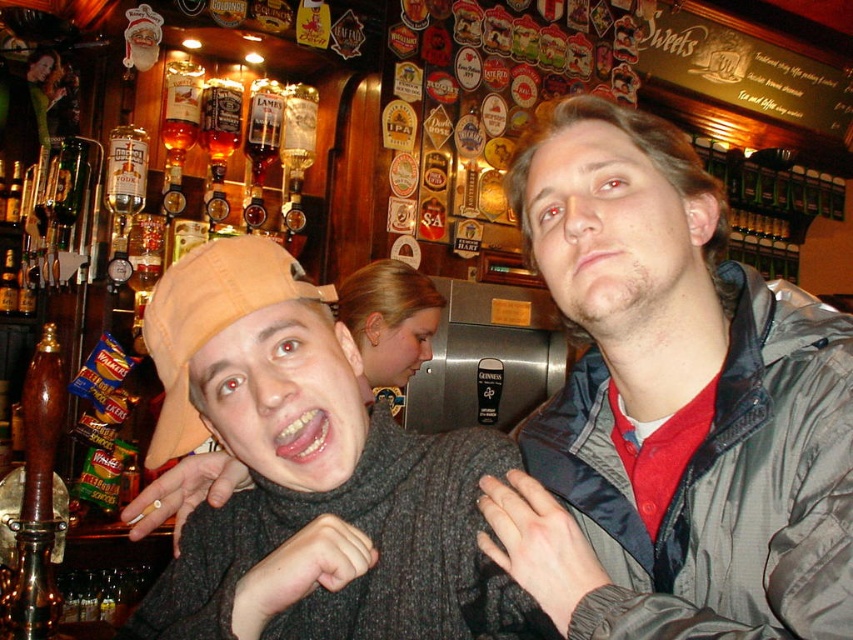
Question: Which object is farther from the camera taking this photo?

Choices:
 (A) knitted sweater at center
 (B) gray fabric jacket at center

Answer: (A)

Question: Which point is closer to the camera taking this photo?

Choices:
 (A) (234, 330)
 (B) (833, 596)

Answer: (B)

Question: Which point is closer to the camera?

Choices:
 (A) (144, 323)
 (B) (743, 540)

Answer: (B)

Question: Can you confirm if gray fabric jacket at center is wider than knitted sweater at center?

Choices:
 (A) yes
 (B) no

Answer: (B)

Question: Is gray fabric jacket at center thinner than knitted sweater at center?

Choices:
 (A) no
 (B) yes

Answer: (B)

Question: Does gray fabric jacket at center have a lesser width compared to knitted sweater at center?

Choices:
 (A) yes
 (B) no

Answer: (A)